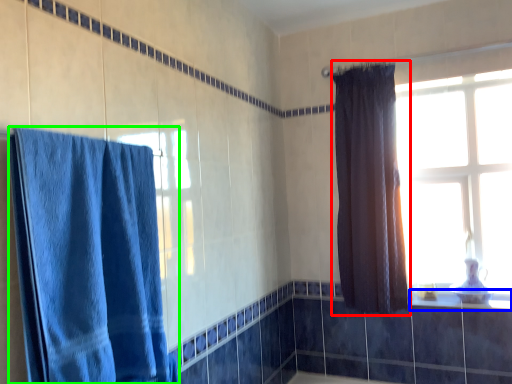
Question: Which object is positioned farthest from curtain (highlighted by a red box)? Select from window sill (highlighted by a blue box) and curtain (highlighted by a green box).

Choices:
 (A) window sill
 (B) curtain

Answer: (B)